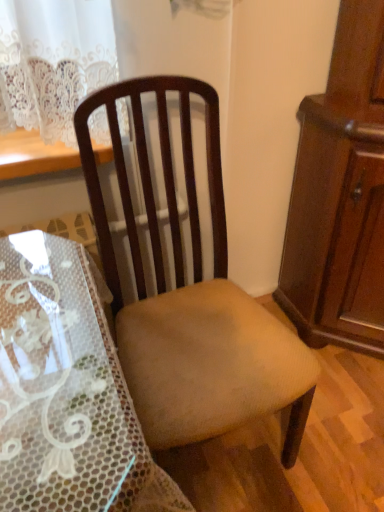
Question: From a real-world perspective, is mahogany wood cabinet at right above or below wooden chair at center?

Choices:
 (A) below
 (B) above

Answer: (B)

Question: Is mahogany wood cabinet at right spatially inside wooden chair at center, or outside of it?

Choices:
 (A) inside
 (B) outside

Answer: (B)

Question: In terms of size, does mahogany wood cabinet at right appear bigger or smaller than wooden chair at center?

Choices:
 (A) small
 (B) big

Answer: (B)

Question: From a real-world perspective, is wooden chair at center above or below mahogany wood cabinet at right?

Choices:
 (A) below
 (B) above

Answer: (A)

Question: Looking at the image, does wooden chair at center seem bigger or smaller compared to mahogany wood cabinet at right?

Choices:
 (A) small
 (B) big

Answer: (A)

Question: From the image's perspective, is wooden chair at center positioned above or below mahogany wood cabinet at right?

Choices:
 (A) below
 (B) above

Answer: (A)

Question: Is wooden chair at center wider or thinner than mahogany wood cabinet at right?

Choices:
 (A) thin
 (B) wide

Answer: (B)